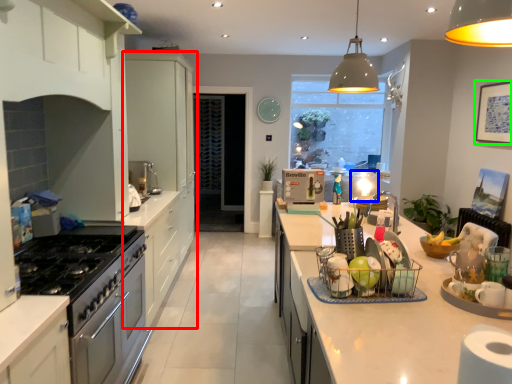
Question: Which object is positioned farthest from cabinetry (highlighted by a red box)? Select from appliance (highlighted by a blue box) and picture frame (highlighted by a green box).

Choices:
 (A) appliance
 (B) picture frame

Answer: (B)